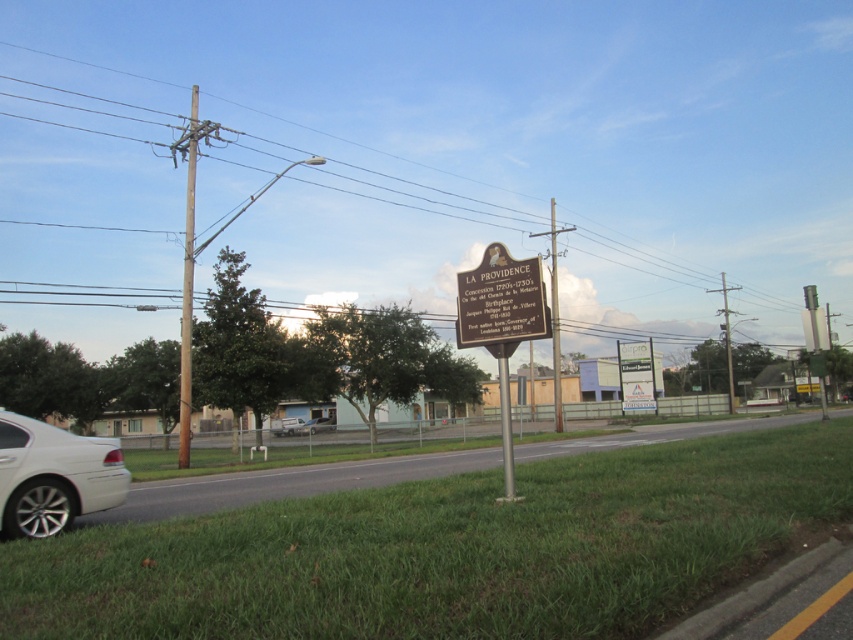
Between white metallic car at lower left and matte metal sign at center, which one has less height?

white metallic car at lower left is shorter.

Between white metallic car at lower left and matte metal sign at center, which one has more height?

matte metal sign at center

You are a GUI agent. You are given a task and a screenshot of the screen. Output one action in this format:
    pyautogui.click(x=<x>, y=<y>)
    Task: Click on the white metallic car at lower left
    The width and height of the screenshot is (853, 640).
    Given the screenshot: What is the action you would take?
    [53, 476]

Locate an element on the screen. Image resolution: width=853 pixels, height=640 pixels. white metallic car at lower left is located at coordinates (53, 476).

The width and height of the screenshot is (853, 640). Describe the element at coordinates (53, 476) in the screenshot. I see `white metallic car at lower left` at that location.

The image size is (853, 640). I want to click on white metallic car at lower left, so coord(53,476).

Is white metallic car at lower left taller than white plastic sign at center?

No.

Which is in front, point (15, 465) or point (621, 362)?

Point (15, 465) is more forward.

Find the location of `white metallic car at lower left`. white metallic car at lower left is located at coordinates 53,476.

This screenshot has width=853, height=640. I want to click on white metallic car at lower left, so click(53, 476).